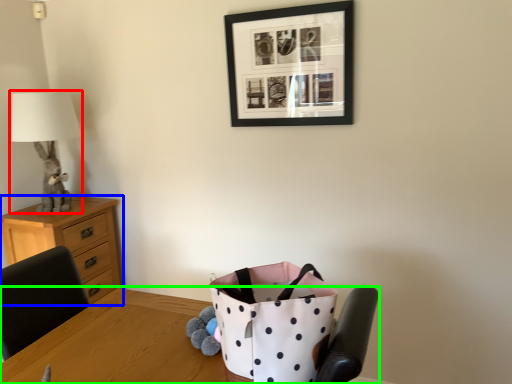
Question: Which object is positioned farthest from table lamp (highlighted by a red box)? Select from chest of drawers (highlighted by a blue box) and table (highlighted by a green box).

Choices:
 (A) chest of drawers
 (B) table

Answer: (B)